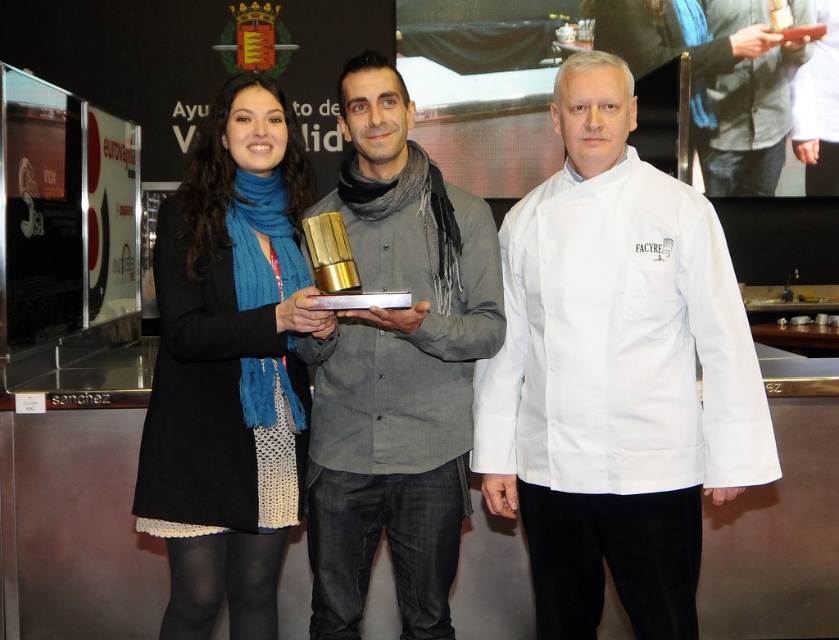
Is matte gold trophy at center bigger than matte gray scarf at center?

Indeed, matte gold trophy at center has a larger size compared to matte gray scarf at center.

How distant is matte gold trophy at center from matte gray scarf at center?

matte gold trophy at center is 4.67 inches away from matte gray scarf at center.

Does point (618, 301) come farther from viewer compared to point (388, 173)?

No, it is not.

Find the location of a particular element. The width and height of the screenshot is (839, 640). matte gold trophy at center is located at coordinates (615, 372).

From the picture: Is matte gold trophy at center to the left of white fabric chef coat at center from the viewer's perspective?

Correct, you'll find matte gold trophy at center to the left of white fabric chef coat at center.

Between matte gold trophy at center and white fabric chef coat at center, which one is positioned lower?

white fabric chef coat at center is lower down.

Measure the distance between point (670,426) and camera.

Point (670,426) and camera are 1.79 meters apart.

Identify the location of matte gold trophy at center. This screenshot has height=640, width=839. (615, 372).

Can you confirm if white fabric chef coat at center is positioned to the right of black wool coat at left?

Correct, you'll find white fabric chef coat at center to the right of black wool coat at left.

I want to click on white fabric chef coat at center, so click(616, 374).